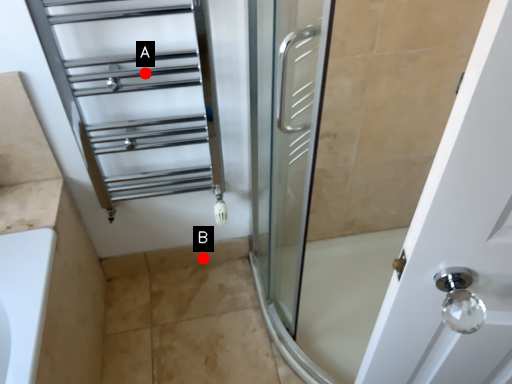
Question: Two points are circled on the image, labeled by A and B beside each circle. Which point is farther to the camera?

Choices:
 (A) A is further
 (B) B is further

Answer: (B)